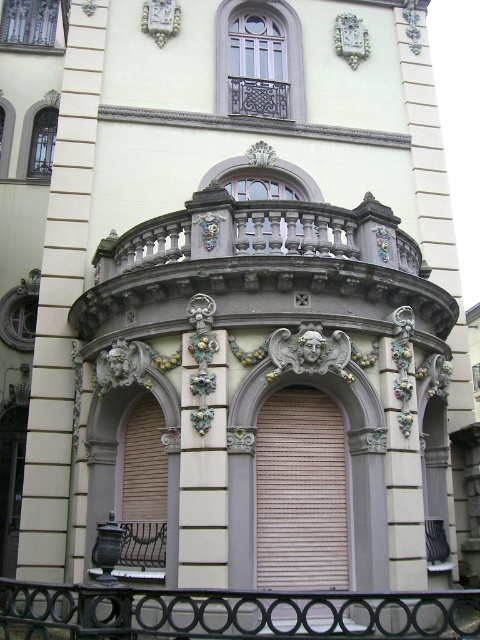
From the picture: You are an architect designing a model of this building. You need to ensure the black wrought iron railing at lower center and the white glossy pillar at center are scaled correctly. Which object should be made larger in the model to maintain accuracy?

The black wrought iron railing at lower center should be made larger in the model than the white glossy pillar at center to maintain accuracy, as it is larger in size according to the description.

You are an architect examining the building facade. You need to determine the spatial relationship between the carved stone balcony at center and the white stone column at center. Which object is positioned to the right of the other?

The carved stone balcony at center is to the right of white stone column at center.